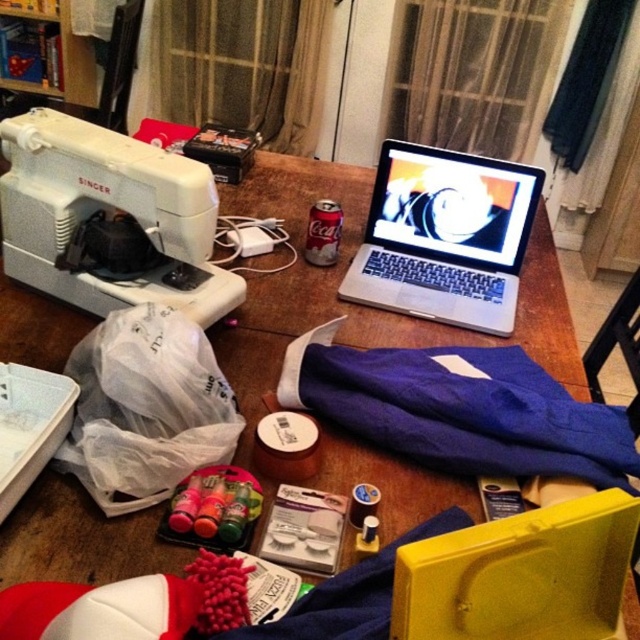
Question: Is white plastic sewing machine at left further to camera compared to silver metallic laptop at upper center?

Choices:
 (A) no
 (B) yes

Answer: (A)

Question: Which of the following is the closest to the observer?

Choices:
 (A) purple fabric at center
 (B) white plastic sewing machine at left

Answer: (A)

Question: Which point is closer to the camera taking this photo?

Choices:
 (A) (80, 292)
 (B) (506, 205)

Answer: (A)

Question: From the image, what is the correct spatial relationship of purple fabric at center in relation to silver metallic laptop at upper center?

Choices:
 (A) left
 (B) right

Answer: (A)

Question: Which point is closer to the camera?

Choices:
 (A) silver metallic laptop at upper center
 (B) purple fabric at center
 (C) white plastic sewing machine at left

Answer: (B)

Question: Where is purple fabric at center located in relation to silver metallic laptop at upper center in the image?

Choices:
 (A) right
 (B) left

Answer: (B)